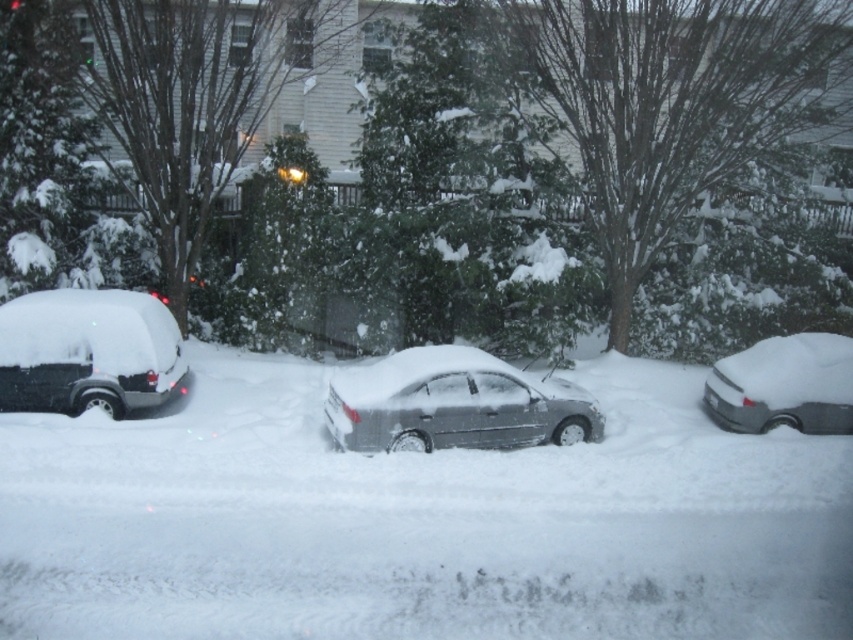
Question: Which of the following is the closest to the observer?

Choices:
 (A) matte black van at left
 (B) white fluffy snow at center
 (C) sleek silver sedan at center
 (D) silver metallic sedan at right

Answer: (B)

Question: In this image, where is sleek silver sedan at center located relative to silver metallic sedan at right?

Choices:
 (A) above
 (B) below

Answer: (A)

Question: Where is white fluffy snow at center located in relation to sleek silver sedan at center in the image?

Choices:
 (A) below
 (B) above

Answer: (A)

Question: Which point is farther from the camera taking this photo?

Choices:
 (A) (712, 408)
 (B) (498, 372)

Answer: (A)

Question: Can you confirm if matte black van at left is smaller than silver metallic sedan at right?

Choices:
 (A) no
 (B) yes

Answer: (A)

Question: Which point is farther to the camera?

Choices:
 (A) pos(286,536)
 (B) pos(33,349)

Answer: (B)